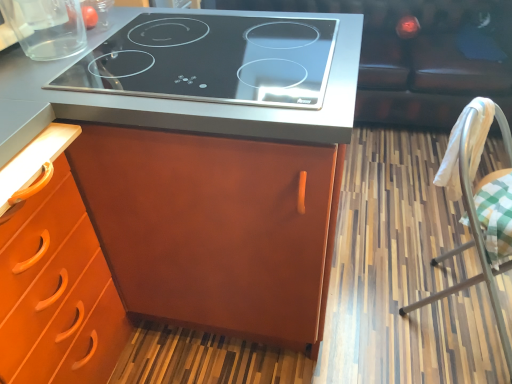
Question: From the image's perspective, is white fabric-covered chair at right located above or below black glass cooktop at upper center?

Choices:
 (A) above
 (B) below

Answer: (B)

Question: Is white fabric-covered chair at right inside or outside of black glass cooktop at upper center?

Choices:
 (A) inside
 (B) outside

Answer: (B)

Question: Based on their relative distances, which object is farther from the matte wood cabinet at center?

Choices:
 (A) leather couch at upper right
 (B) black glass cooktop at upper center
 (C) white fabric-covered chair at right
 (D) transparent glass container at upper left

Answer: (A)

Question: Which is nearer to the leather couch at upper right?

Choices:
 (A) transparent glass container at upper left
 (B) matte wood cabinet at center
 (C) black glass cooktop at upper center
 (D) white fabric-covered chair at right

Answer: (D)